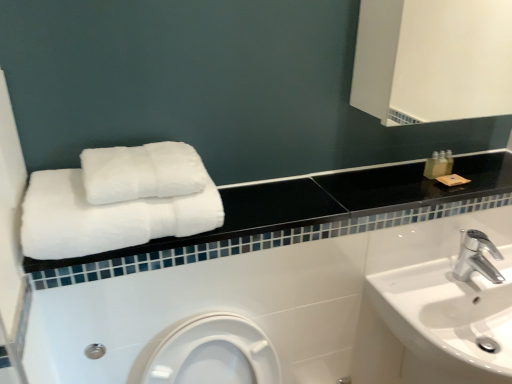
Question: From the image's perspective, is white glossy sink at lower right located beneath translucent plastic bottle at upper right?

Choices:
 (A) yes
 (B) no

Answer: (A)

Question: Is white glossy sink at lower right wider than translucent plastic bottle at upper right?

Choices:
 (A) no
 (B) yes

Answer: (B)

Question: Is white glossy sink at lower right to the left of translucent plastic bottle at upper right from the viewer's perspective?

Choices:
 (A) no
 (B) yes

Answer: (A)

Question: Is white glossy sink at lower right outside of translucent plastic bottle at upper right?

Choices:
 (A) yes
 (B) no

Answer: (A)

Question: Would you consider white glossy sink at lower right to be distant from translucent plastic bottle at upper right?

Choices:
 (A) yes
 (B) no

Answer: (B)

Question: Considering the relative sizes of white glossy sink at lower right and translucent plastic bottle at upper right in the image provided, is white glossy sink at lower right thinner than translucent plastic bottle at upper right?

Choices:
 (A) no
 (B) yes

Answer: (A)

Question: From a real-world perspective, is silver metallic faucet at lower right positioned over translucent plastic bottle at upper right based on gravity?

Choices:
 (A) no
 (B) yes

Answer: (A)

Question: Is silver metallic faucet at lower right far from translucent plastic bottle at upper right?

Choices:
 (A) yes
 (B) no

Answer: (B)

Question: Can you confirm if silver metallic faucet at lower right is taller than translucent plastic bottle at upper right?

Choices:
 (A) yes
 (B) no

Answer: (A)

Question: Is silver metallic faucet at lower right to the right of translucent plastic bottle at upper right from the viewer's perspective?

Choices:
 (A) no
 (B) yes

Answer: (B)

Question: Is silver metallic faucet at lower right oriented towards translucent plastic bottle at upper right?

Choices:
 (A) no
 (B) yes

Answer: (A)

Question: Is translucent plastic bottle at upper right a part of silver metallic faucet at lower right?

Choices:
 (A) yes
 (B) no

Answer: (B)

Question: Is translucent plastic bottle at upper right looking in the opposite direction of white fluffy towels at upper left, which is the 2th towel from top to bottom?

Choices:
 (A) no
 (B) yes

Answer: (A)